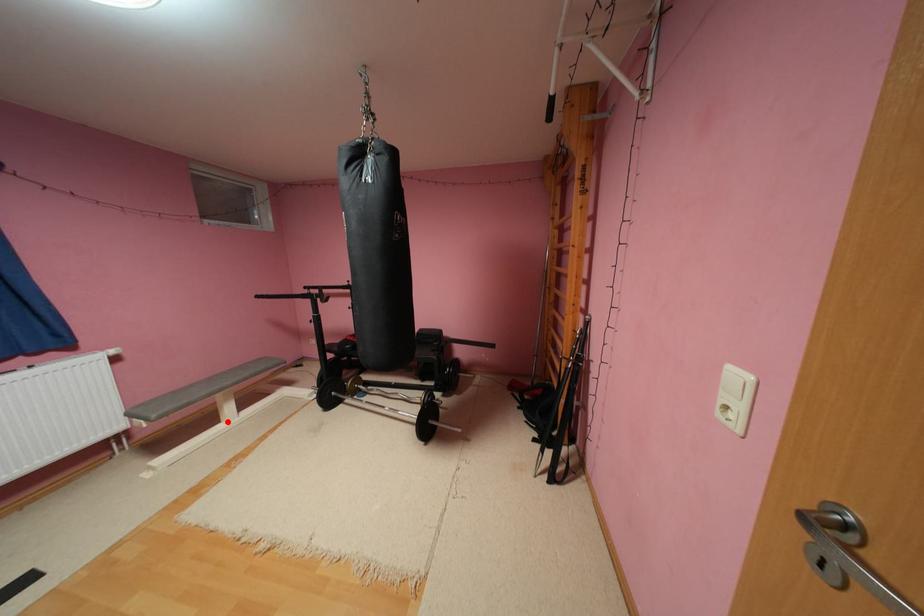
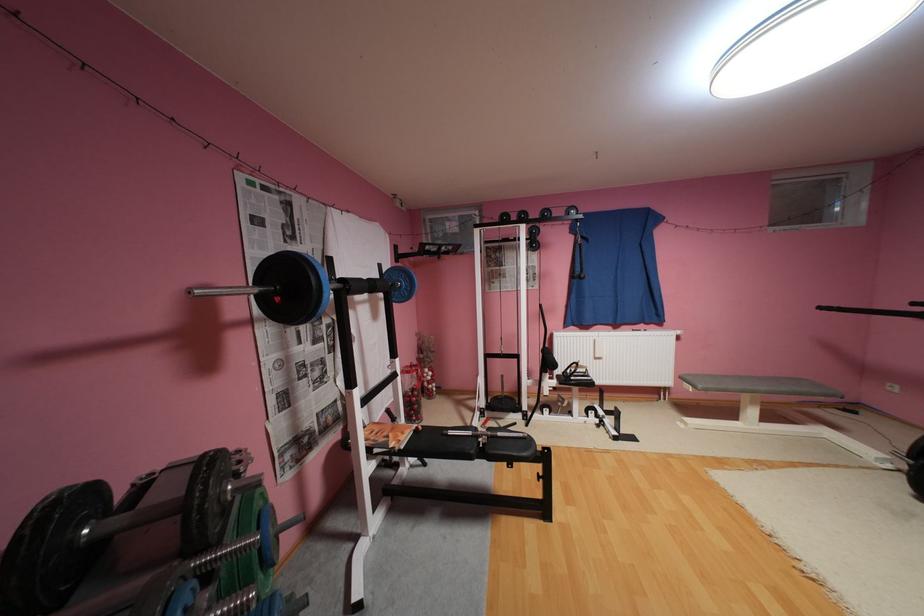
Find the pixel in the second image that matches the highlighted location in the first image.

(746, 419)